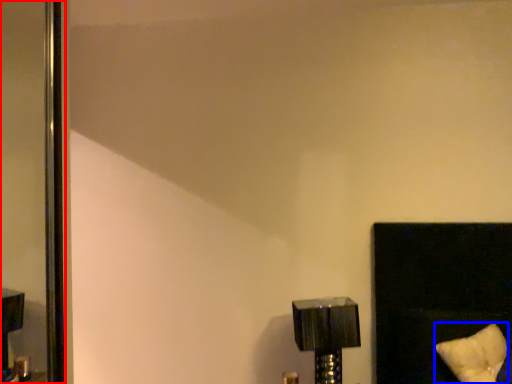
Question: Which of the following is the farthest to the observer, screen door (highlighted by a red box) or pillow (highlighted by a blue box)?

Choices:
 (A) screen door
 (B) pillow

Answer: (A)